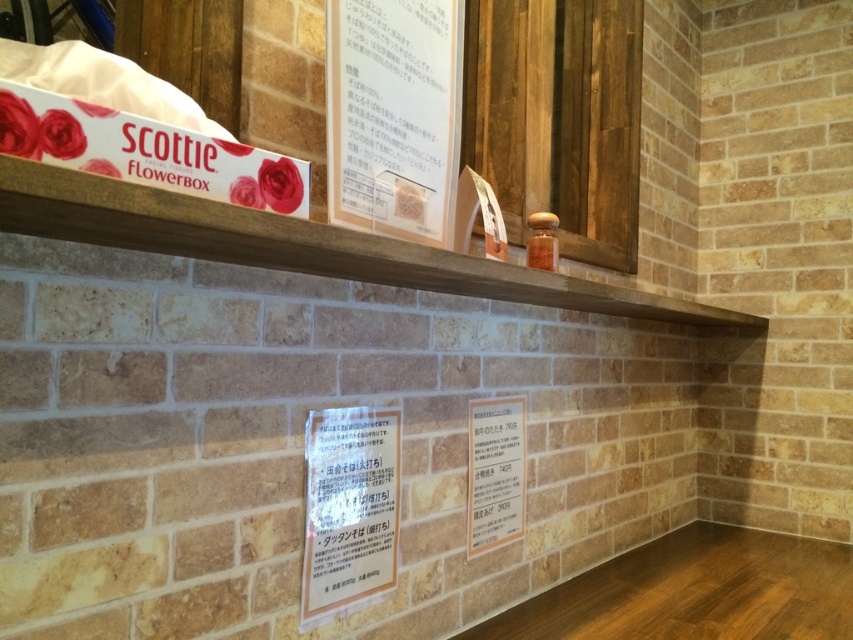
Who is more forward, (357, 147) or (517, 417)?

Point (357, 147) is in front.

What do you see at coordinates (393, 115) in the screenshot? The width and height of the screenshot is (853, 640). I see `white paper at upper center` at bounding box center [393, 115].

In order to click on white paper at upper center in this screenshot , I will do `click(393, 115)`.

Who is shorter, white paper at upper center or white paper sign at center?

Standing shorter between the two is white paper sign at center.

Between white paper at upper center and white paper sign at center, which one appears on the left side from the viewer's perspective?

white paper sign at center

Where is `white paper at upper center`? white paper at upper center is located at coordinates (393, 115).

Is the position of wooden shelf at upper center more distant than that of white paper at upper center?

No, it is in front of white paper at upper center.

Which is more to the right, wooden shelf at upper center or white paper at upper center?

Positioned to the right is wooden shelf at upper center.

Find the location of a particular element. wooden shelf at upper center is located at coordinates (300, 244).